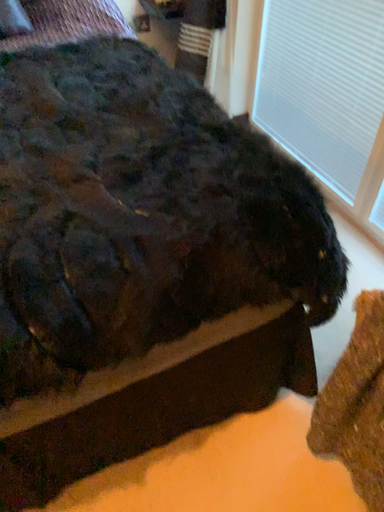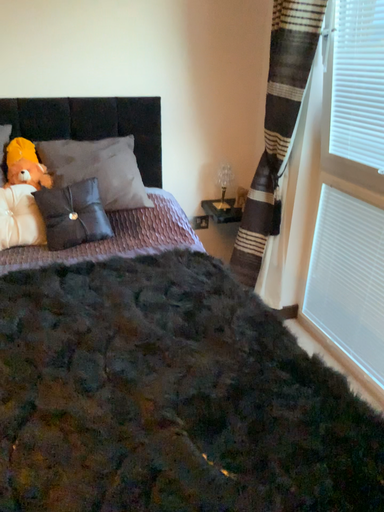
Question: How did the camera likely rotate when shooting the video?

Choices:
 (A) rotated downward
 (B) rotated upward

Answer: (B)